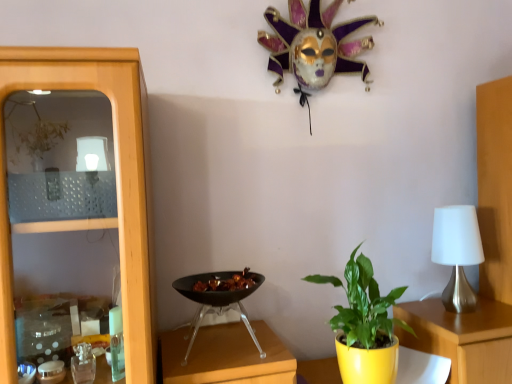
Question: From a real-world perspective, does green glossy leafy plant at center stand above satin silver table lamp at right?

Choices:
 (A) yes
 (B) no

Answer: (B)

Question: From the image's perspective, does green glossy leafy plant at center appear lower than satin silver table lamp at right?

Choices:
 (A) no
 (B) yes

Answer: (B)

Question: Does green glossy leafy plant at center have a smaller size compared to satin silver table lamp at right?

Choices:
 (A) no
 (B) yes

Answer: (A)

Question: Is green glossy leafy plant at center to the right of satin silver table lamp at right from the viewer's perspective?

Choices:
 (A) yes
 (B) no

Answer: (B)

Question: From the image's perspective, is green glossy leafy plant at center on satin silver table lamp at right?

Choices:
 (A) yes
 (B) no

Answer: (B)

Question: Is black glossy wok at center wider or thinner than green glossy leafy plant at center?

Choices:
 (A) thin
 (B) wide

Answer: (B)

Question: Visually, is black glossy wok at center positioned to the left or to the right of green glossy leafy plant at center?

Choices:
 (A) left
 (B) right

Answer: (A)

Question: From the image's perspective, is black glossy wok at center positioned above or below green glossy leafy plant at center?

Choices:
 (A) above
 (B) below

Answer: (A)

Question: Based on their sizes in the image, would you say black glossy wok at center is bigger or smaller than green glossy leafy plant at center?

Choices:
 (A) small
 (B) big

Answer: (A)

Question: From their relative heights in the image, would you say green glossy leafy plant at center is taller or shorter than black glossy wok at center?

Choices:
 (A) short
 (B) tall

Answer: (B)

Question: From a real-world perspective, is green glossy leafy plant at center positioned above or below black glossy wok at center?

Choices:
 (A) above
 (B) below

Answer: (B)

Question: From the image's perspective, is green glossy leafy plant at center positioned above or below black glossy wok at center?

Choices:
 (A) above
 (B) below

Answer: (B)

Question: In terms of width, does green glossy leafy plant at center look wider or thinner when compared to black glossy wok at center?

Choices:
 (A) wide
 (B) thin

Answer: (B)

Question: Based on their positions, is black glossy wok at center located to the left or right of satin silver table lamp at right?

Choices:
 (A) left
 (B) right

Answer: (A)

Question: Is black glossy wok at center bigger or smaller than satin silver table lamp at right?

Choices:
 (A) big
 (B) small

Answer: (A)